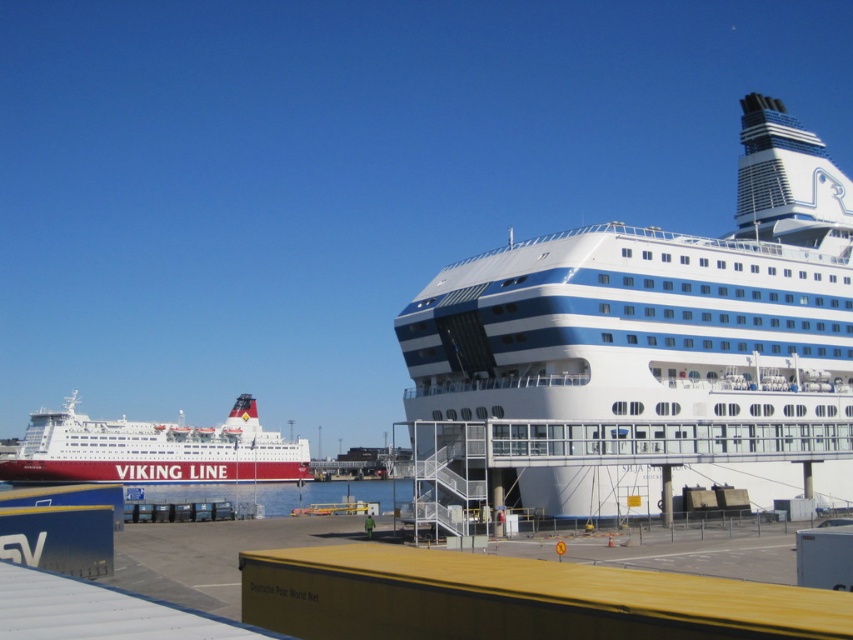
Question: Which object appears farthest from the camera in this image?

Choices:
 (A) white glossy ferry at left
 (B) white glossy cruise ship at right

Answer: (A)

Question: Does white glossy cruise ship at right have a larger size compared to white glossy ferry at left?

Choices:
 (A) yes
 (B) no

Answer: (B)

Question: Which of the following is the farthest from the observer?

Choices:
 (A) (170, 428)
 (B) (593, 289)

Answer: (A)

Question: Does white glossy cruise ship at right have a smaller size compared to white glossy ferry at left?

Choices:
 (A) no
 (B) yes

Answer: (B)

Question: Does white glossy cruise ship at right have a lesser width compared to white glossy ferry at left?

Choices:
 (A) no
 (B) yes

Answer: (B)